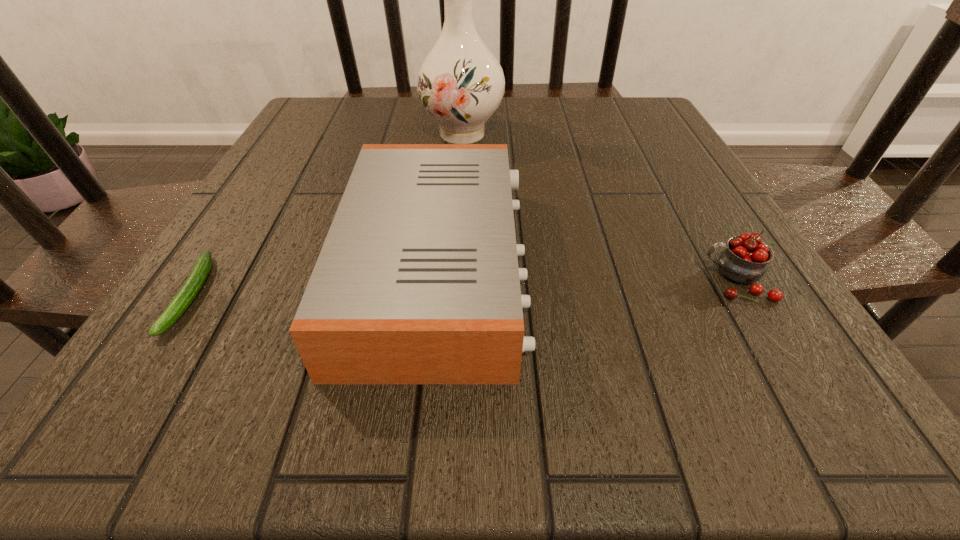
Locate an element on the screen. The width and height of the screenshot is (960, 540). vase is located at coordinates (460, 83).

Find the location of `the tallest object`. the tallest object is located at coordinates click(x=460, y=83).

I want to click on radio receiver, so click(417, 282).

Image resolution: width=960 pixels, height=540 pixels. I want to click on cherry, so click(x=745, y=260).

Image resolution: width=960 pixels, height=540 pixels. I want to click on zucchini, so click(184, 297).

In order to click on the shortest object in this screenshot , I will do `click(184, 297)`.

Image resolution: width=960 pixels, height=540 pixels. Identify the location of vacant space located on the left of the tallest object. (378, 133).

Image resolution: width=960 pixels, height=540 pixels. I want to click on free space located on the control panel of the radio receiver, so click(x=615, y=268).

Locate an element on the screen. The width and height of the screenshot is (960, 540). vacant space positioned 0.150m on the handle side of the rightmost object is located at coordinates (604, 280).

Identify the location of free space located on the handle side of the rightmost object. (484, 280).